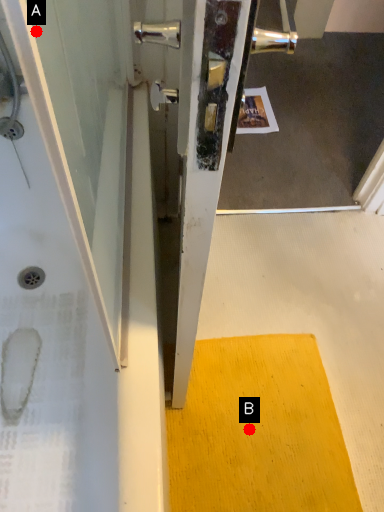
Question: Two points are circled on the image, labeled by A and B beside each circle. Which point is closer to the camera taking this photo?

Choices:
 (A) A is closer
 (B) B is closer

Answer: (A)